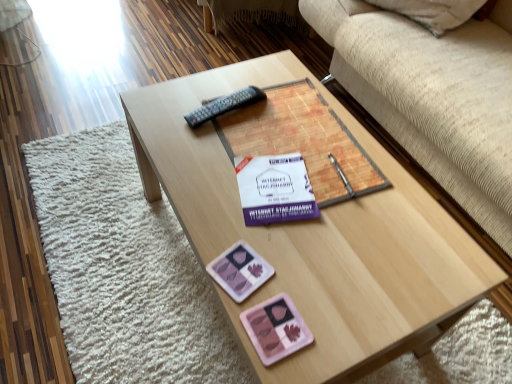
At what (x,y) coordinates should I click in order to perform the action: click on free space between black plastic remote at center and pink plastic at lower center, which is the second currency in bottom-to-top order. Please return your answer as a coordinate pair (x, y). Image resolution: width=512 pixels, height=384 pixels. Looking at the image, I should click on (226, 180).